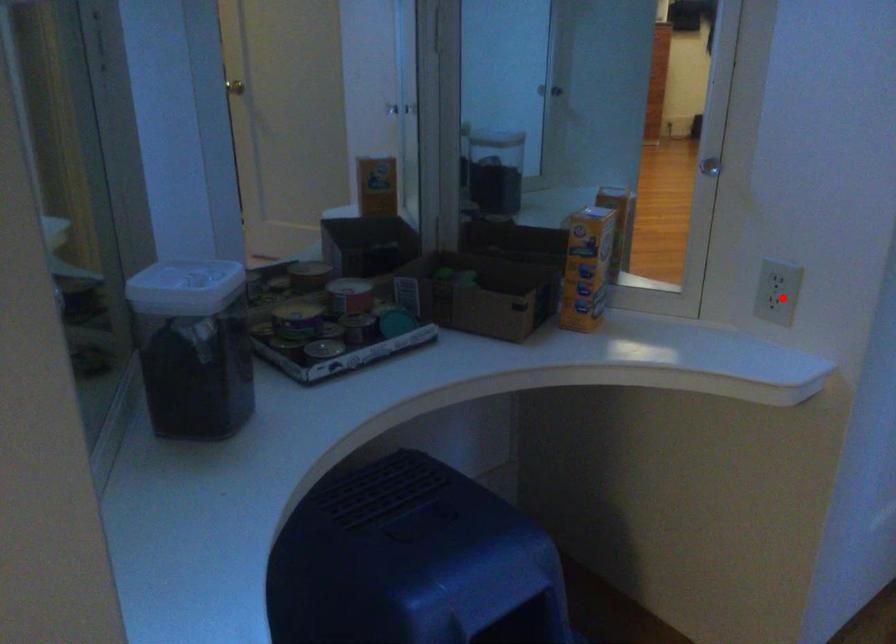
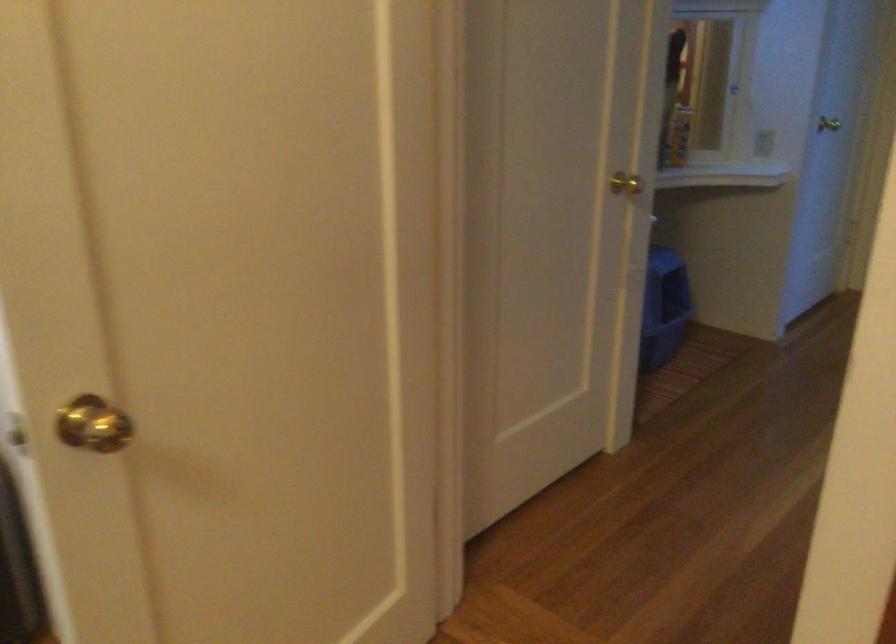
Question: A red point is marked in image1. In image2, is the corresponding 3D point closer to the camera or farther? Reply with the corresponding letter.

Choices:
 (A) The corresponding 3D point is closer.
 (B) The corresponding 3D point is farther.

Answer: (B)